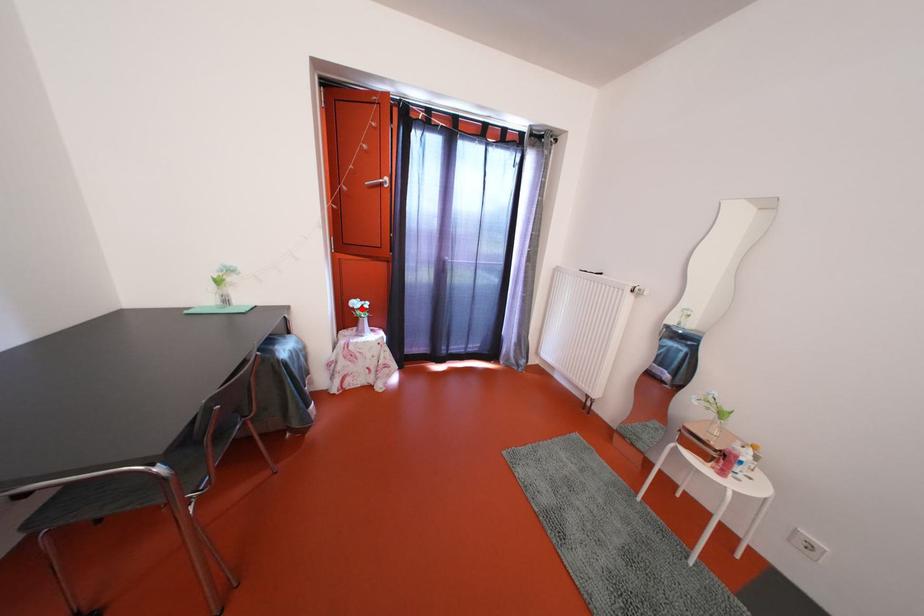
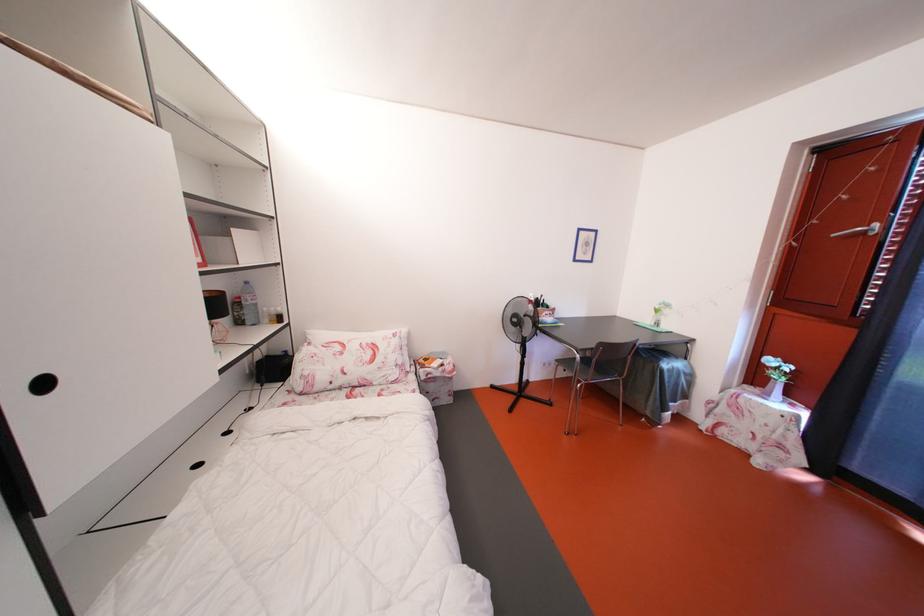
Find the pixel in the second image that matches the highlighted location in the first image.

(779, 367)